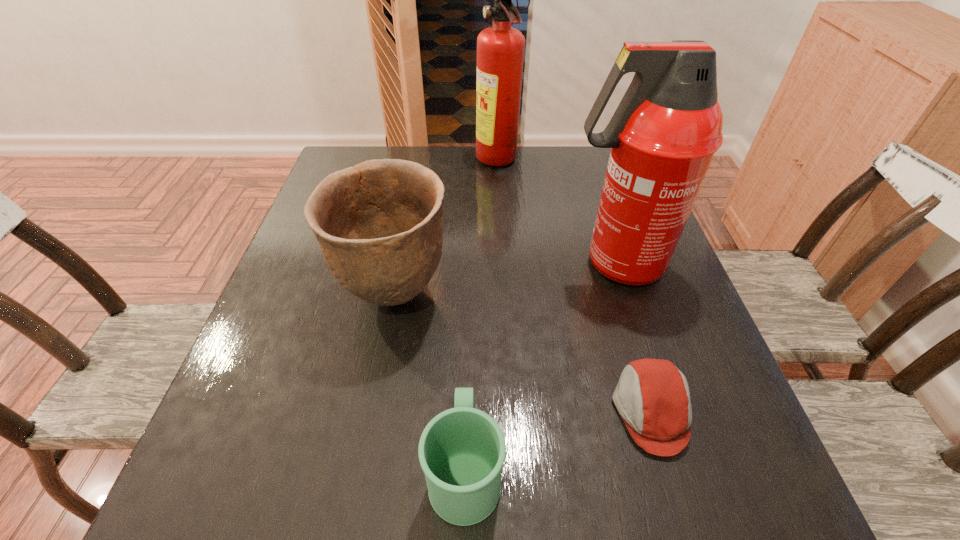
Locate which object ranks third in proximity to the pottery. Please provide its 2D coordinates. Your answer should be formatted as a tuple, i.e. [(x, y)], where the tuple contains the x and y coordinates of a point satisfying the conditions above.

[(652, 396)]

Locate an element on the screen. This screenshot has width=960, height=540. vacant area in the image that satisfies the following two spatial constraints: 1. on the front-facing side of the left fire extinguisher; 2. on the front side of the third shortest object is located at coordinates (505, 295).